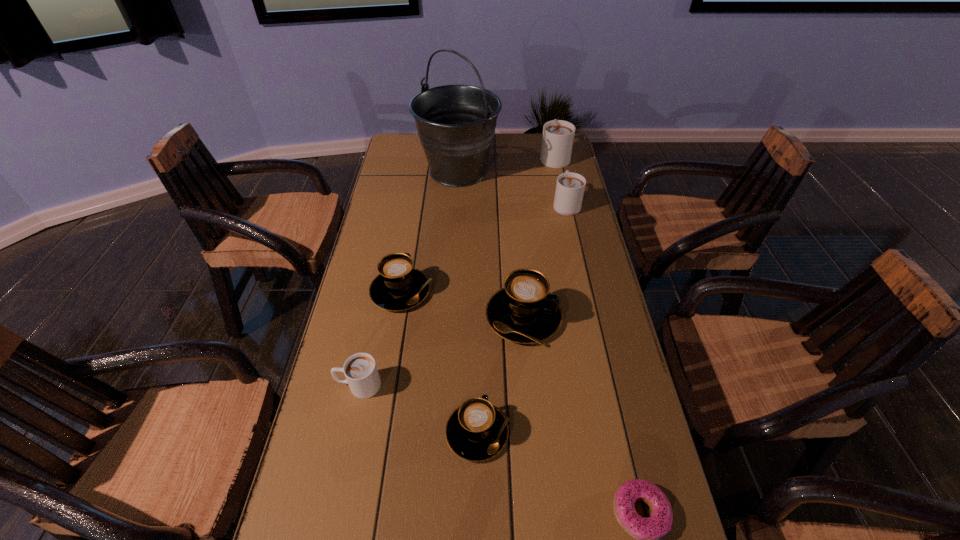
In order to click on blank area at the far right corner in this screenshot , I will do `click(529, 136)`.

What are the coordinates of `free space between the smallest black cappuccino and the biggest black cappuccino` in the screenshot? It's located at (500, 375).

Find the location of a particular element. The height and width of the screenshot is (540, 960). free point between the second smallest black cappuccino and the gray bucket is located at coordinates click(429, 231).

Locate an element on the screen. This screenshot has height=540, width=960. empty location between the gray bucket and the second farthest white cappuccino is located at coordinates (512, 187).

The height and width of the screenshot is (540, 960). Identify the location of free space between the bucket and the farthest white cappuccino. (506, 164).

Find the location of a particular element. The image size is (960, 540). object that is the sixth closest one to the second smallest white cappuccino is located at coordinates (360, 370).

Where is `object that can be found as the sixth closest to the leftmost black cappuccino`? This screenshot has height=540, width=960. object that can be found as the sixth closest to the leftmost black cappuccino is located at coordinates (648, 532).

In order to click on cappuccino that is the sixth closest to the tallest object in this screenshot , I will do `click(476, 431)`.

Locate which cappuccino is the fifth closest to the fifth nearest cappuccino. Please provide its 2D coordinates. Your answer should be formatted as a tuple, i.e. [(x, y)], where the tuple contains the x and y coordinates of a point satisfying the conditions above.

[(360, 370)]

You are a GUI agent. You are given a task and a screenshot of the screen. Output one action in this format:
    pyautogui.click(x=<x>, y=<y>)
    Task: Click on the closest white cappuccino to the leftmost black cappuccino
    This screenshot has width=960, height=540.
    Given the screenshot: What is the action you would take?
    pyautogui.click(x=360, y=370)